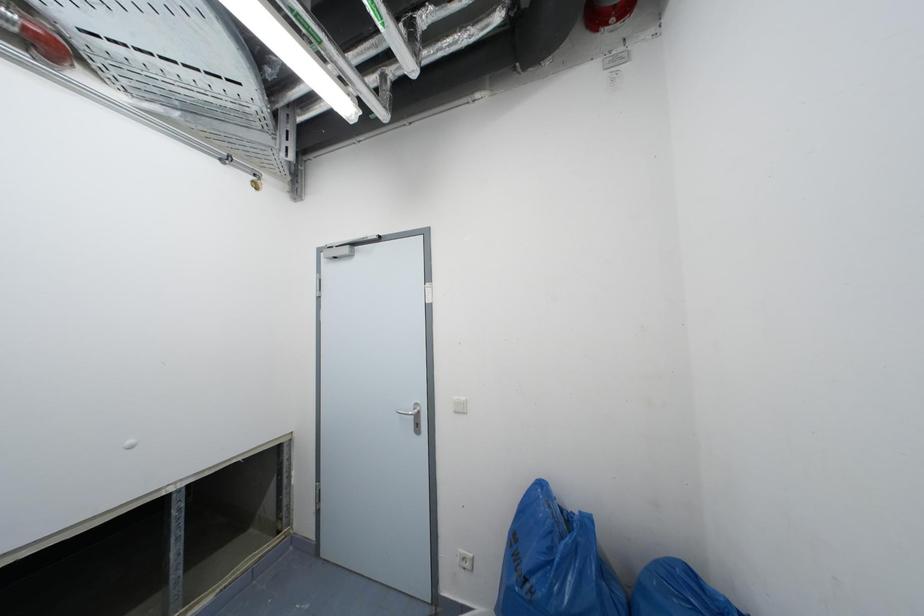
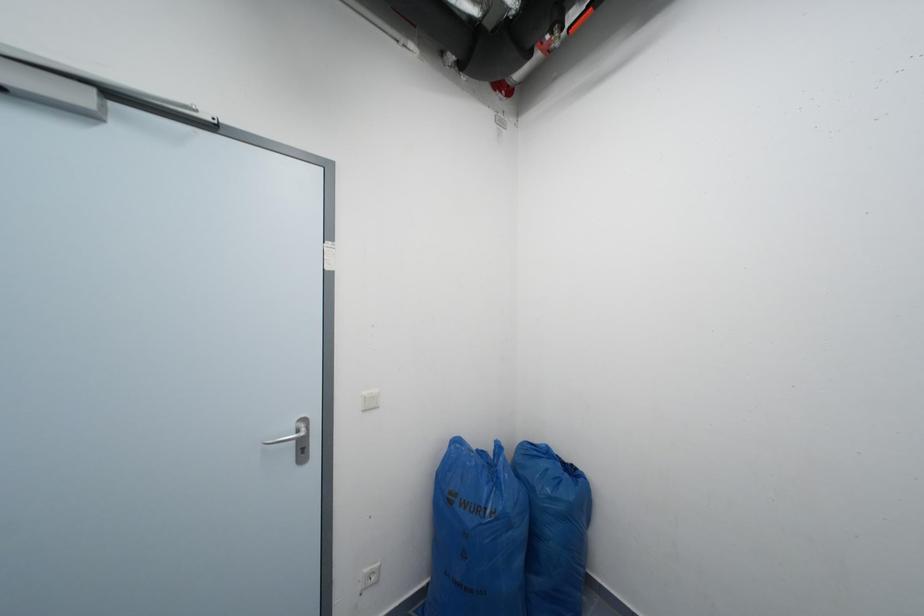
Question: The images are taken continuously from a first-person perspective. In which direction is your viewpoint rotating?

Choices:
 (A) Left
 (B) Right
 (C) Up
 (D) Down

Answer: (B)